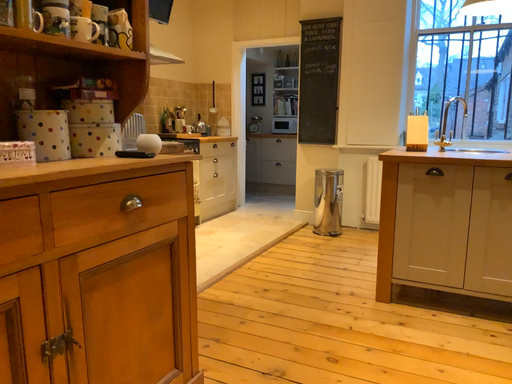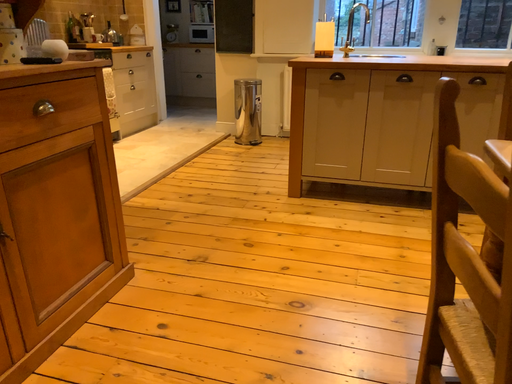
Question: How did the camera likely rotate when shooting the video?

Choices:
 (A) rotated left
 (B) rotated right

Answer: (B)